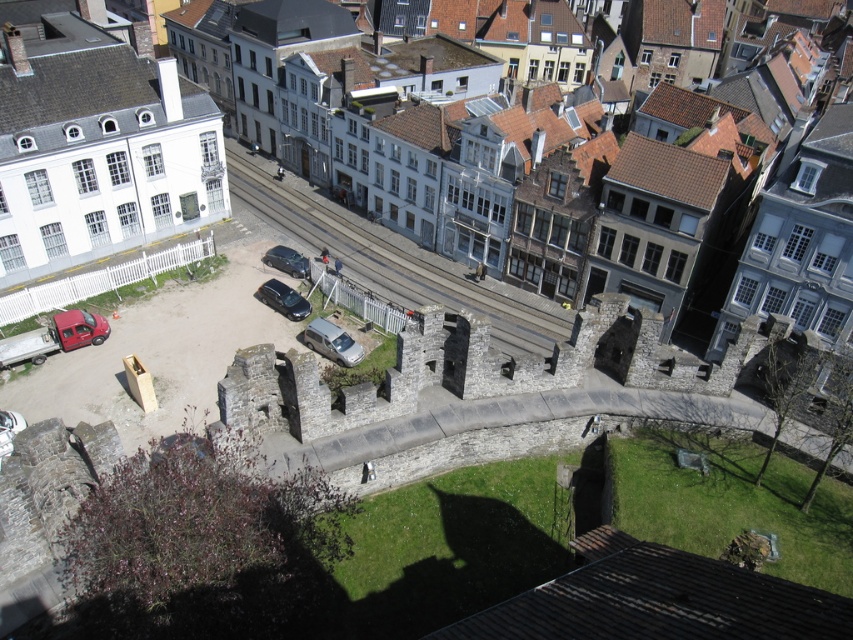
Which is more to the right, stone wall at center or metallic red van at lower left?

stone wall at center

Who is lower down, stone wall at center or metallic red van at lower left?

metallic red van at lower left is lower down.

Does point (370, 164) come in front of point (78, 314)?

No, (370, 164) is behind (78, 314).

The image size is (853, 640). What are the coordinates of `stone wall at center` in the screenshot? It's located at (669, 180).

This screenshot has width=853, height=640. I want to click on smooth asphalt train track at center, so click(x=393, y=257).

Can you confirm if smooth asphalt train track at center is taller than metallic red van at lower left?

Yes.

Who is more distant from viewer, [511,346] or [74,317]?

Point [511,346]

Find the location of `smooth asphalt train track at center`. smooth asphalt train track at center is located at coordinates (393, 257).

Is point (347, 355) more distant than point (289, 259)?

That is False.

Can you confirm if silver metallic van at center is thinner than shiny silver car at center?

No.

Does point (334, 337) come behind point (300, 266)?

That is False.

Locate an element on the screen. This screenshot has height=640, width=853. silver metallic van at center is located at coordinates (332, 342).